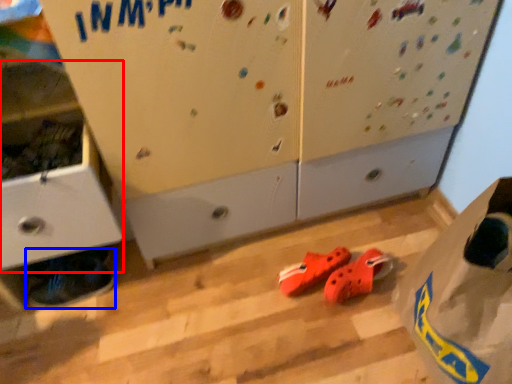
Question: Which of the following is the farthest to the observer, cabinetry (highlighted by a red box) or footwear (highlighted by a blue box)?

Choices:
 (A) cabinetry
 (B) footwear

Answer: (B)